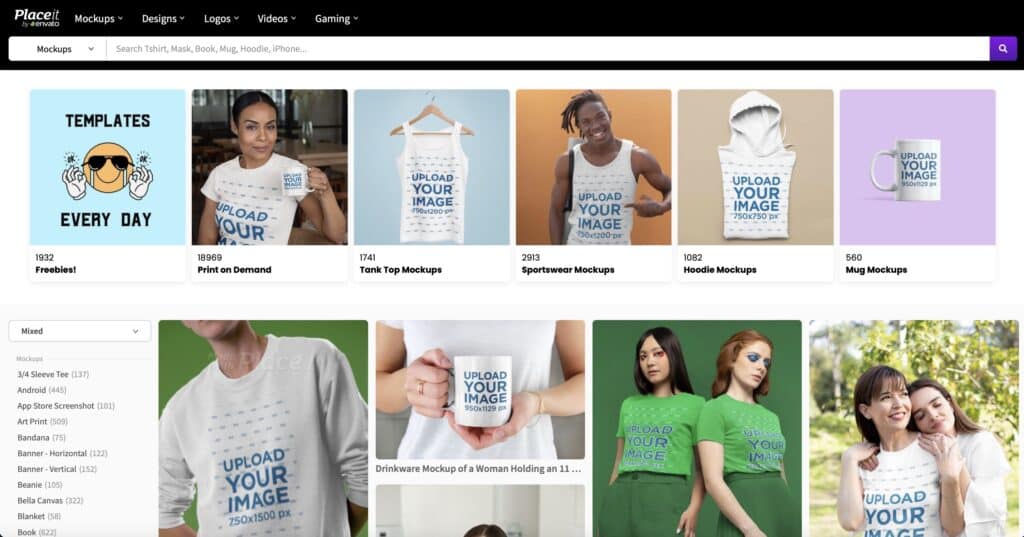
At what (x,y) coordinates should I click in order to perform the action: click on mugs where you would upload your image to. Please return your answer as a coordinate pair (x, y). Looking at the image, I should click on coord(489,395), coord(925,170).